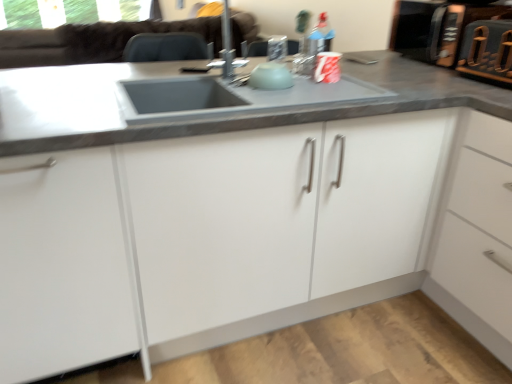
Question: Does white matte cabinet at center have a smaller size compared to metallic silver toaster at upper right?

Choices:
 (A) no
 (B) yes

Answer: (A)

Question: Is metallic silver toaster at upper right surrounded by white matte cabinet at center?

Choices:
 (A) yes
 (B) no

Answer: (B)

Question: From the image's perspective, does white matte cabinet at center appear higher than metallic silver toaster at upper right?

Choices:
 (A) no
 (B) yes

Answer: (A)

Question: Is white matte cabinet at center shorter than metallic silver toaster at upper right?

Choices:
 (A) yes
 (B) no

Answer: (B)

Question: From a real-world perspective, does white matte cabinet at center sit lower than metallic silver toaster at upper right?

Choices:
 (A) yes
 (B) no

Answer: (A)

Question: Considering the relative positions of white matte cabinet at center and metallic silver toaster at upper right in the image provided, is white matte cabinet at center to the right of metallic silver toaster at upper right from the viewer's perspective?

Choices:
 (A) yes
 (B) no

Answer: (B)

Question: Does metallic silver toaster at upper right have a greater height compared to white matte cabinet at center?

Choices:
 (A) yes
 (B) no

Answer: (B)

Question: Does metallic silver toaster at upper right have a smaller size compared to white matte cabinet at center?

Choices:
 (A) no
 (B) yes

Answer: (B)

Question: From a real-world perspective, is metallic silver toaster at upper right located beneath white matte cabinet at center?

Choices:
 (A) no
 (B) yes

Answer: (A)

Question: Does metallic silver toaster at upper right touch white matte cabinet at center?

Choices:
 (A) no
 (B) yes

Answer: (A)

Question: Is white matte cabinet at center completely or partially inside metallic silver toaster at upper right?

Choices:
 (A) no
 (B) yes

Answer: (A)

Question: Can you confirm if metallic silver toaster at upper right is positioned to the right of white matte cabinet at center?

Choices:
 (A) no
 (B) yes

Answer: (B)

Question: From a real-world perspective, is white matte cabinet at center above or below metallic silver toaster at upper right?

Choices:
 (A) above
 (B) below

Answer: (B)